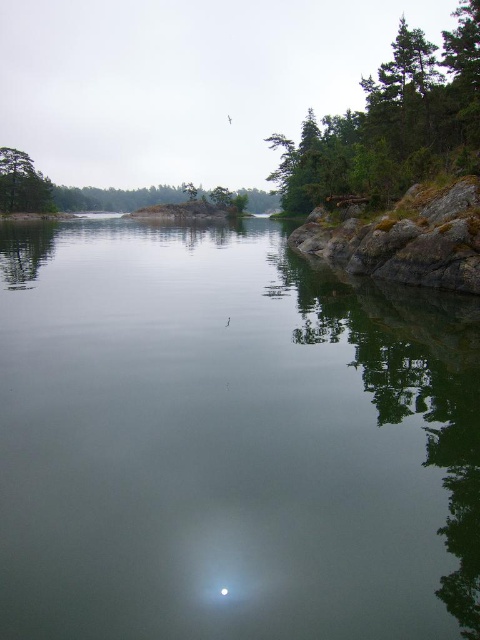
Which is behind, point (403, 618) or point (369, 147)?

Point (369, 147)

Can you confirm if transparent water at center is positioned above green leafy tree at upper right?

Actually, transparent water at center is below green leafy tree at upper right.

Between point (333, 582) and point (384, 74), which one is positioned in front?

Point (333, 582) is in front.

Find the location of a particular element. The image size is (480, 640). transparent water at center is located at coordinates (228, 444).

Who is more forward, (447, 147) or (12, 189)?

Point (447, 147)

Based on the photo, between green leafy tree at upper right and green matte tree at left, which one is positioned higher?

green matte tree at left is above.

Does point (360, 118) come in front of point (3, 202)?

Yes, point (360, 118) is closer to viewer.

Locate an element on the screen. green leafy tree at upper right is located at coordinates (391, 122).

Is point (373, 611) more distant than point (9, 188)?

No, it is not.

Does transparent water at center have a larger size compared to green matte tree at left?

Correct, transparent water at center is larger in size than green matte tree at left.

Is point (57, 371) behind point (27, 184)?

No, (57, 371) is in front of (27, 184).

The image size is (480, 640). I want to click on transparent water at center, so click(x=228, y=444).